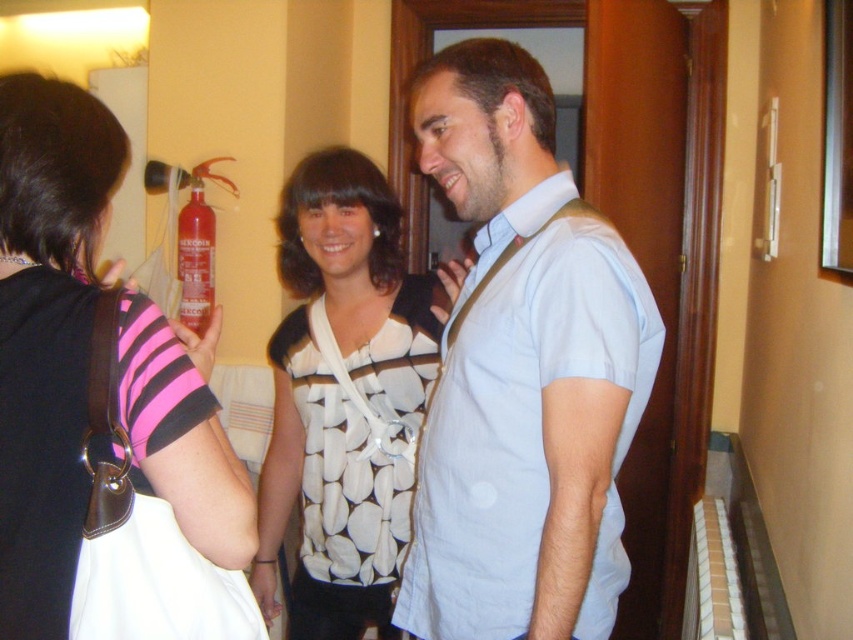
Question: Does pink striped shirt at upper left appear under white dotted fabric at center?

Choices:
 (A) no
 (B) yes

Answer: (A)

Question: Which point is farther to the camera?

Choices:
 (A) pink striped shirt at upper left
 (B) white dotted fabric at center
 (C) light blue shirt at center

Answer: (B)

Question: Among these objects, which one is nearest to the camera?

Choices:
 (A) white dotted fabric at center
 (B) pink striped shirt at upper left
 (C) light blue shirt at center

Answer: (B)

Question: Is light blue shirt at center further to the viewer compared to pink striped shirt at upper left?

Choices:
 (A) no
 (B) yes

Answer: (B)

Question: Can you confirm if light blue shirt at center is positioned to the left of pink striped shirt at upper left?

Choices:
 (A) yes
 (B) no

Answer: (B)

Question: Based on their relative distances, which object is nearer to the light blue shirt at center?

Choices:
 (A) white dotted fabric at center
 (B) pink striped shirt at upper left

Answer: (A)